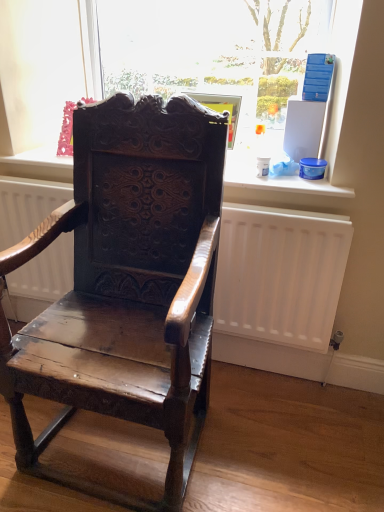
Question: Relative to white matte radiator at center, is shiny dark wood chair at center in front or behind?

Choices:
 (A) front
 (B) behind

Answer: (A)

Question: Looking at their shapes, would you say shiny dark wood chair at center is wider or thinner than white matte radiator at center?

Choices:
 (A) wide
 (B) thin

Answer: (A)

Question: Considering the real-world distances, which object is closest to the white matte radiator at center?

Choices:
 (A) transparent glass at upper center
 (B) shiny dark wood chair at center

Answer: (B)

Question: Estimate the real-world distances between objects in this image. Which object is farther from the shiny dark wood chair at center?

Choices:
 (A) transparent glass at upper center
 (B) white matte radiator at center

Answer: (A)